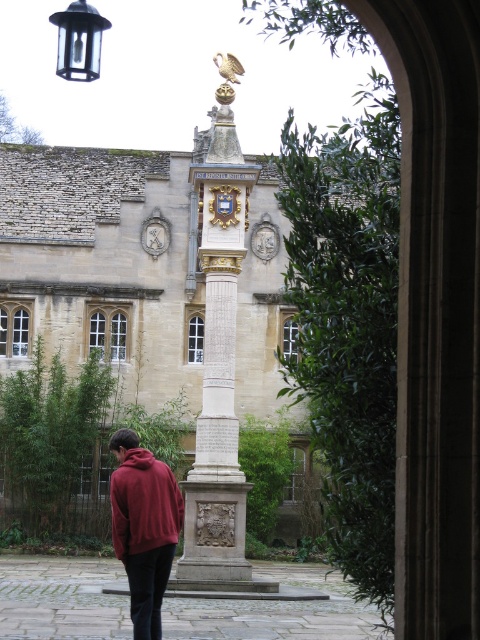
Question: Is gold polished stone column at center above maroon fleece jacket at lower left?

Choices:
 (A) no
 (B) yes

Answer: (B)

Question: Is gold polished stone column at center thinner than maroon fleece jacket at lower left?

Choices:
 (A) no
 (B) yes

Answer: (B)

Question: Is gold polished stone column at center below maroon fleece jacket at lower left?

Choices:
 (A) yes
 (B) no

Answer: (B)

Question: Which point is closer to the camera?

Choices:
 (A) (231, 180)
 (B) (132, 548)

Answer: (B)

Question: Which point is farther from the camera taking this photo?

Choices:
 (A) (247, 589)
 (B) (132, 548)

Answer: (A)